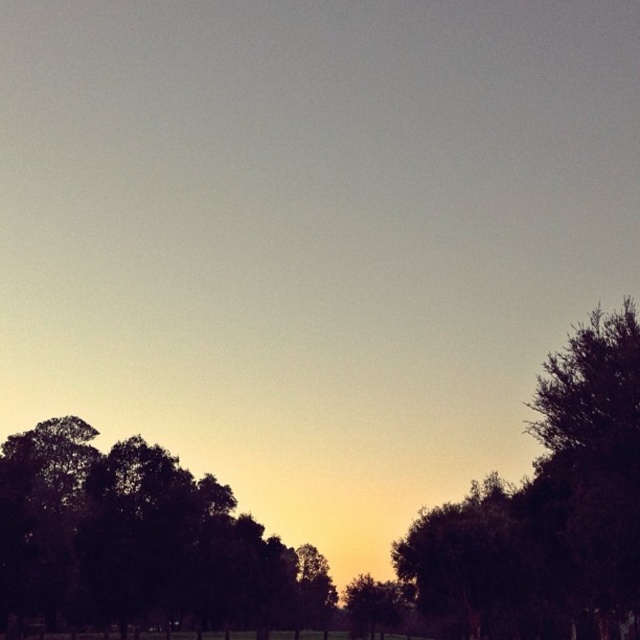
You are an artist planning to paint this sunset scene. You want to ensure the dark green leafy tree at left and the green matte tree at center are proportionally accurate. Which tree should you paint larger?

The dark green leafy tree at left should be painted larger since it has a larger size compared to the green matte tree at center according to the description.

You are an ornithologist observing birds in the sunset scene. You notice two trees, the dark green leafy tree at right and the green matte tree at center. Which tree would a bird have to fly higher to perch on?

The green matte tree at center is taller than the dark green leafy tree at right, so a bird would need to fly higher to perch on the green matte tree at center.

You are an astronomer observing the sunset scene. You notice two points in the sky, one at point (x=112, y=465) and another at point (x=444, y=593). Which point is closer to you?

Point (x=112, y=465) is closer to the viewer than point (x=444, y=593).